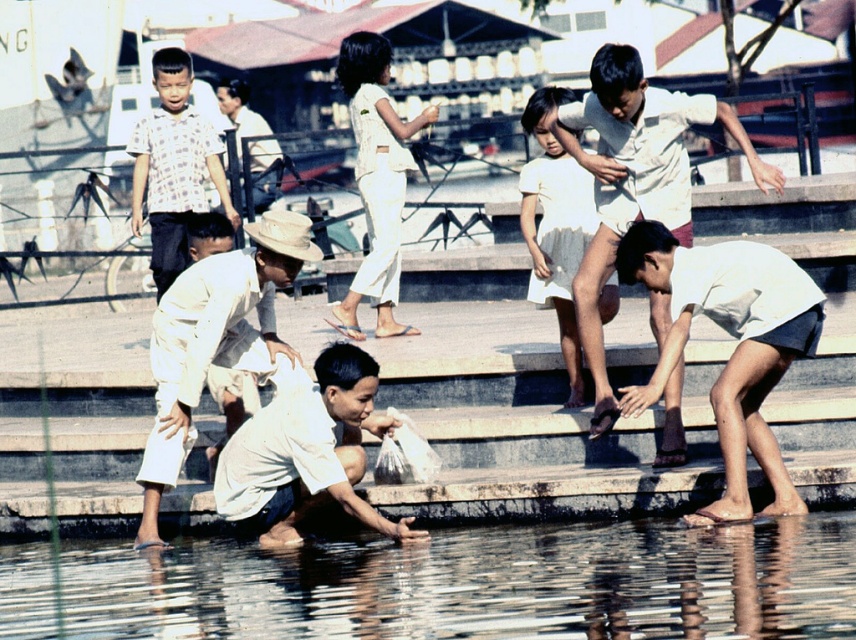
Does clear water at lower center appear on the right side of white matte shirt at lower center?

In fact, clear water at lower center is to the left of white matte shirt at lower center.

Can you confirm if clear water at lower center is positioned above white matte shirt at lower center?

No, clear water at lower center is not above white matte shirt at lower center.

What do you see at coordinates (452, 584) in the screenshot? This screenshot has width=856, height=640. I see `clear water at lower center` at bounding box center [452, 584].

Locate an element on the screen. clear water at lower center is located at coordinates (452, 584).

Between point (239, 588) and point (360, 77), which one is positioned behind?

Point (360, 77)

From the picture: Between clear water at lower center and white cotton pants at center, which one appears on the left side from the viewer's perspective?

Positioned to the left is clear water at lower center.

Does point (646, 566) come closer to viewer compared to point (369, 240)?

Yes.

Locate an element on the screen. The height and width of the screenshot is (640, 856). clear water at lower center is located at coordinates (452, 584).

Does white matte shirt at lower center have a greater height compared to white cotton pants at center?

No, white matte shirt at lower center is not taller than white cotton pants at center.

Which is behind, point (324, 348) or point (373, 40)?

Positioned behind is point (373, 40).

Find the location of `white matte shirt at lower center`. white matte shirt at lower center is located at coordinates (306, 452).

What are the coordinates of `white matte shirt at lower center` in the screenshot? It's located at (306, 452).